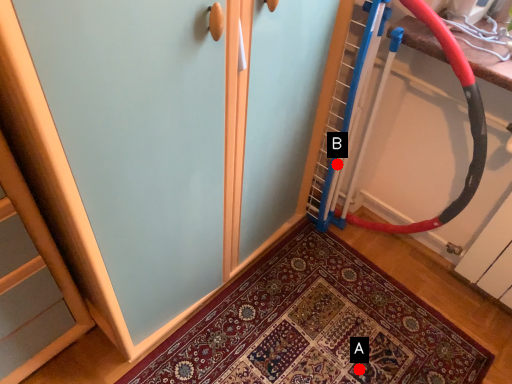
Question: Two points are circled on the image, labeled by A and B beside each circle. Which point is farther from the camera taking this photo?

Choices:
 (A) A is further
 (B) B is further

Answer: (B)